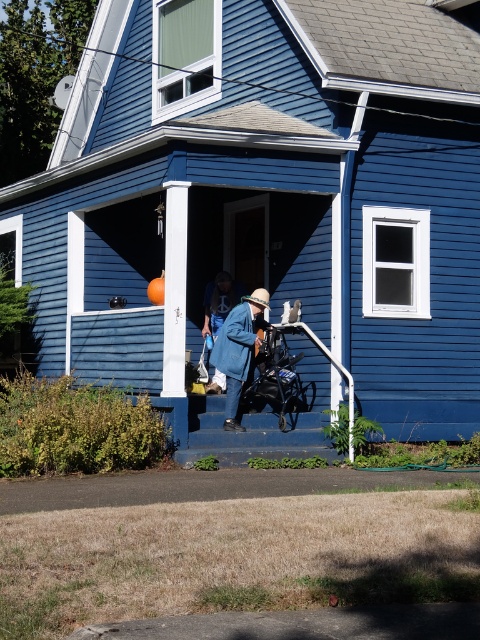
You are a parent carrying a blue fuzzy coat at center and a black fabric baby carriage at center. You want to place both items on the porch step. Which item should you place first to ensure the other can be placed on top?

You should place the black fabric baby carriage at center first because it has a greater height compared to the blue fuzzy coat at center, allowing the coat to be placed on top.

Consider the image. You are a parent trying to reach the blue denim jacket at center while holding the black fabric baby carriage at center. Can you comfortably hold both items without them touching each other?

The distance between the black fabric baby carriage at center and the blue denim jacket at center is 19.49 inches, so yes, you can comfortably hold both items without them touching each other as the space between them allows for safe handling.